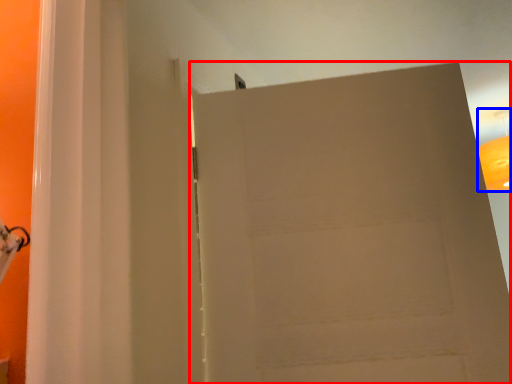
Question: Which object is further to the camera taking this photo, door (highlighted by a red box) or lamp (highlighted by a blue box)?

Choices:
 (A) door
 (B) lamp

Answer: (B)